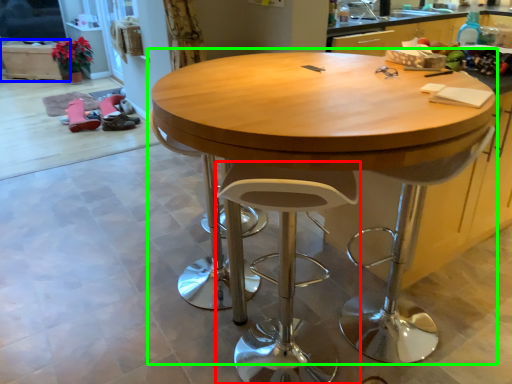
Question: Based on their relative distances, which object is farther from stool (highlighted by a red box)? Choose from cabinetry (highlighted by a blue box) and table (highlighted by a green box).

Choices:
 (A) cabinetry
 (B) table

Answer: (A)